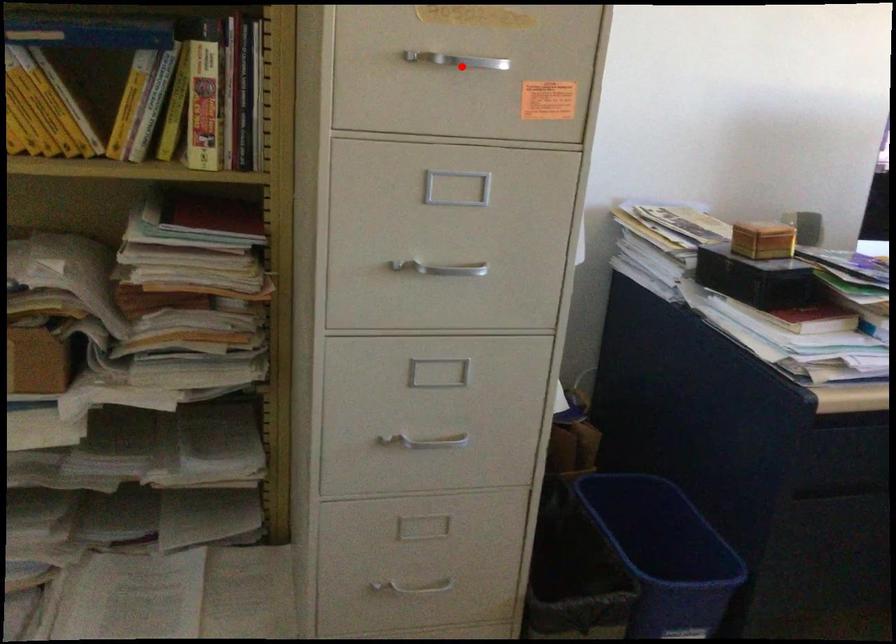
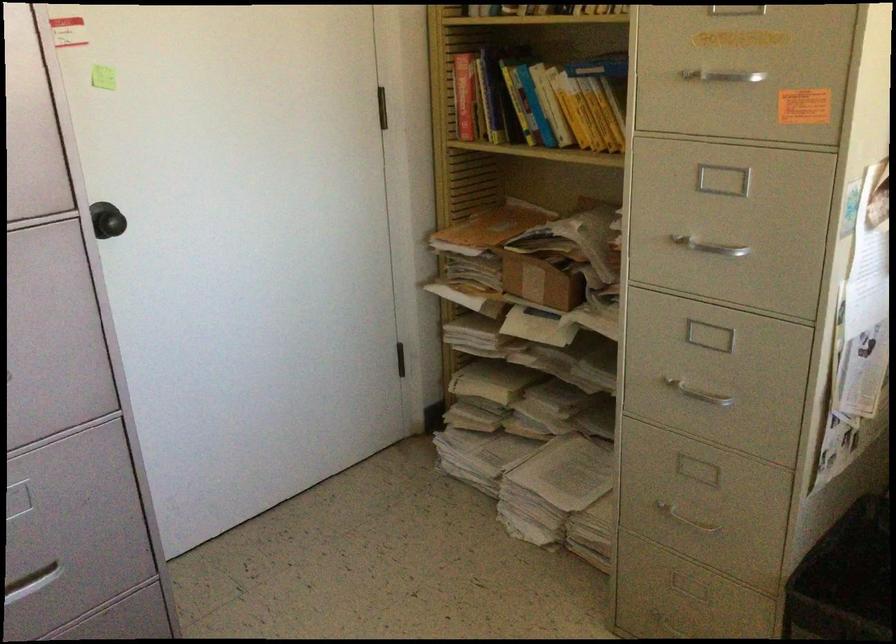
Where in the second image is the point corresponding to the highlighted location from the first image?

(725, 82)